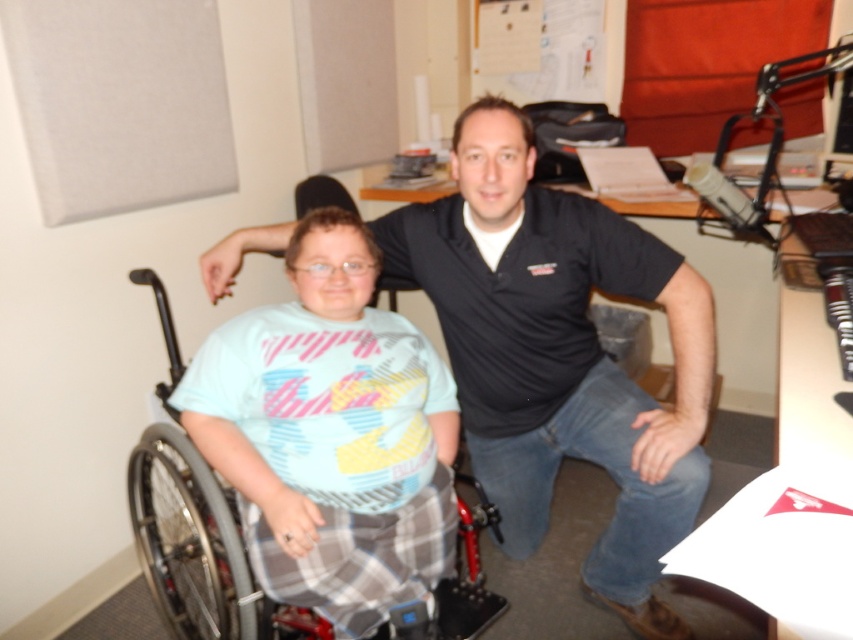
You are standing in the office scene described. You need to reach a point marked at coordinates point [532,161]. If you can move 5 feet forward from your current position, will you be able to reach that point?

The point [532,161] is 4.84 feet away from the viewer. Since you can move 5 feet forward, you will be able to reach the point as 5 feet is greater than 4.84 feet.

You are standing in the office scene and want to place a small plant between the two points labeled point (488, 156) and point (463, 474). Which point should the plant be closer to if it needs to be nearer to the person in the wheelchair?

The plant should be placed closer to point (488, 156) because it is closer to the viewer, aligning it nearer to the person in the wheelchair who is seated at that position.

You are a photographer setting up a shoot in this office. You need to position a light source so it illuminates the black smooth shirt at center without casting a shadow from the gray plastic wheelchair at left. Is this possible based on their positions?

The black smooth shirt at center is located above the gray plastic wheelchair at left. Since the shirt is above the wheelchair, positioning the light source below the shirt could prevent the wheelchair from casting a shadow on it.